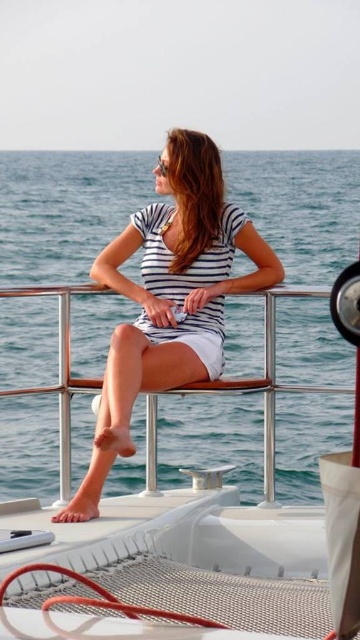
At what (x,y) coordinates should I click in order to perform the action: click on white matte boat at center. Please return your answer as a coordinate pair (x, y). Looking at the image, I should click on (199, 550).

Is white matte boat at center to the left of white striped dress at center from the viewer's perspective?

Incorrect, white matte boat at center is not on the left side of white striped dress at center.

Between point (239, 589) and point (101, 416), which one is positioned behind?

The point (101, 416) is more distant.

The height and width of the screenshot is (640, 360). I want to click on white matte boat at center, so click(199, 550).